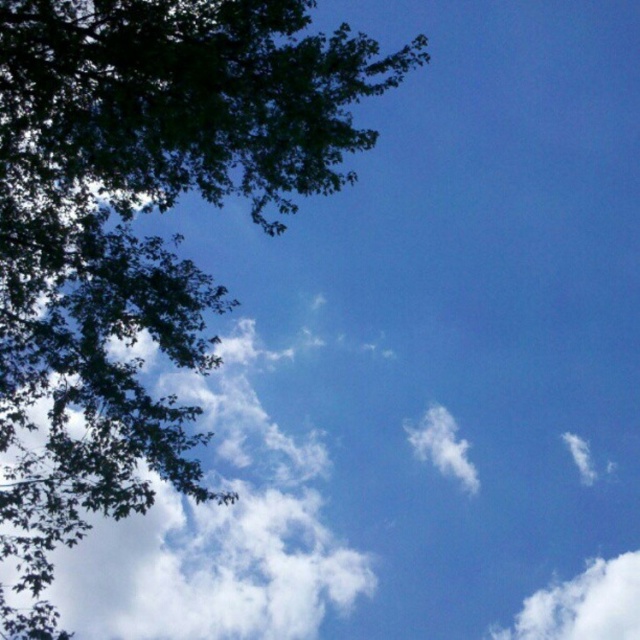
You are standing in the middle of the scene and looking towards the horizon. Which direction should you turn to see the green leafy tree at upper left?

You should turn to your left to see the green leafy tree at upper left because it is located at the upper left corner of the scene.

You are an airplane pilot flying at an altitude of 10,000 feet. You notice two clouds in the sky. The first is the white fluffy cloud at lower right, and the second is the white fluffy cloud at center. Which cloud is lower in the sky?

The white fluffy cloud at lower right is shorter than the white fluffy cloud at center, so the white fluffy cloud at lower right is lower in the sky.